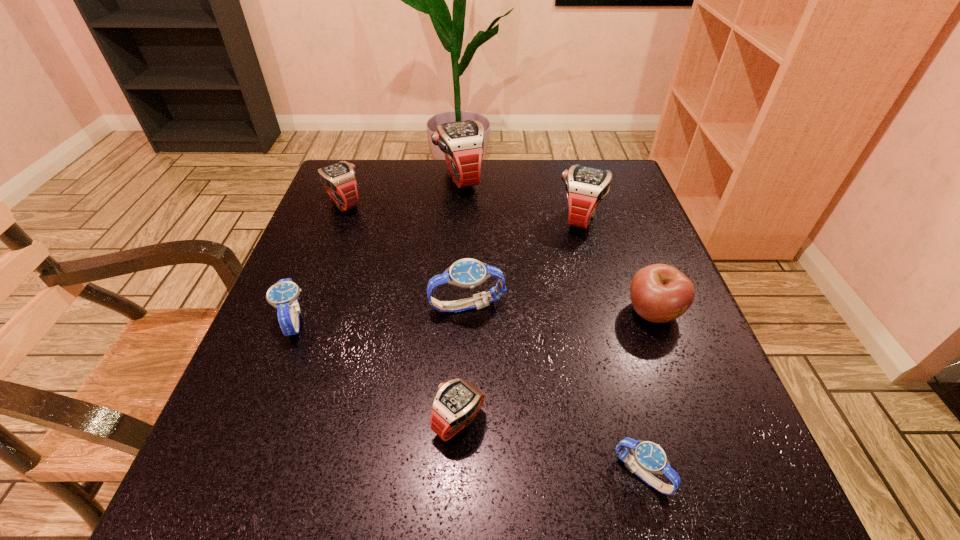
Find the location of a particular element. The width and height of the screenshot is (960, 540). the shortest object is located at coordinates (649, 457).

Identify the location of the shortest watch. (649, 457).

Image resolution: width=960 pixels, height=540 pixels. Find the location of `vacant area situated on the right of the biggest red watch`. vacant area situated on the right of the biggest red watch is located at coordinates (598, 179).

The height and width of the screenshot is (540, 960). Identify the location of free space located on the left of the third smallest red watch. (449, 218).

Identify the location of free space located 0.140m on the front of the third biggest red watch. The width and height of the screenshot is (960, 540). (324, 254).

Locate an element on the screen. This screenshot has height=540, width=960. vacant space located on the left of the second blue watch from right to left is located at coordinates (357, 306).

This screenshot has width=960, height=540. Find the location of `vacant space located on the side of the apple with the unique marking`. vacant space located on the side of the apple with the unique marking is located at coordinates (692, 414).

The width and height of the screenshot is (960, 540). Identify the location of free location located 0.140m on the back of the second smallest blue watch. (322, 251).

You are a GUI agent. You are given a task and a screenshot of the screen. Output one action in this format:
    pyautogui.click(x=<x>, y=<y>)
    Task: Click on the vacant space located 0.250m on the right of the smallest red watch
    
    Given the screenshot: What is the action you would take?
    pyautogui.click(x=645, y=422)

The image size is (960, 540). I want to click on vacant space located 0.350m on the back of the rightmost blue watch, so click(592, 283).